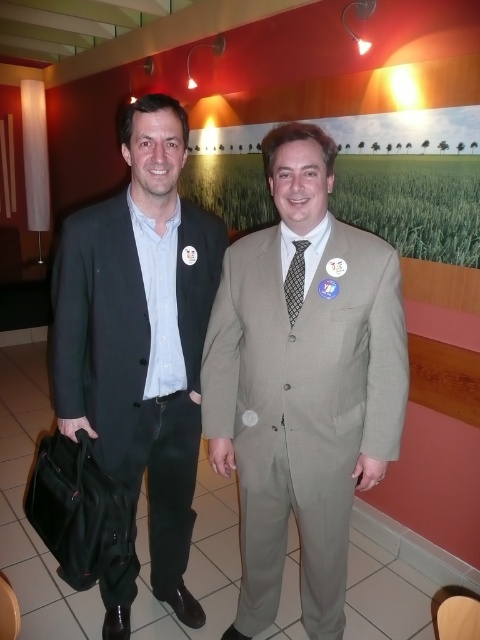
You are a photographer setting up for a group photo. You need to ensure that the matte black suit at left and the black textured tie at center are both visible in the frame. Considering their sizes, which one might require you to adjust the camera angle to include it properly?

The matte black suit at left is taller than the black textured tie at center, so the matte black suit at left might require adjusting the camera angle to ensure it fits within the frame.